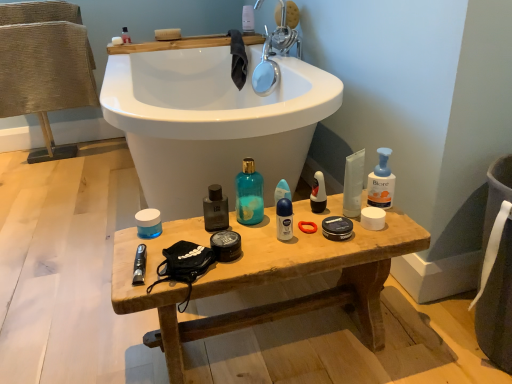
Identify the location of vacant area situated below wooden bench at center (from a real-world perspective). (281, 344).